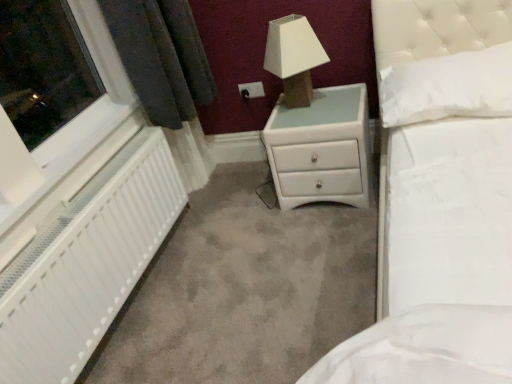
Question: Does white glossy chest of drawers at center have a greater width compared to white textured radiator at left?

Choices:
 (A) yes
 (B) no

Answer: (A)

Question: Is white glossy chest of drawers at center to the right of white textured radiator at left from the viewer's perspective?

Choices:
 (A) yes
 (B) no

Answer: (A)

Question: Would you say white glossy chest of drawers at center is a long distance from white textured radiator at left?

Choices:
 (A) yes
 (B) no

Answer: (B)

Question: Can you confirm if white glossy chest of drawers at center is shorter than white textured radiator at left?

Choices:
 (A) yes
 (B) no

Answer: (A)

Question: From a real-world perspective, is white glossy chest of drawers at center on top of white textured radiator at left?

Choices:
 (A) yes
 (B) no

Answer: (B)

Question: Is white glossy chest of drawers at center positioned in front of white textured radiator at left?

Choices:
 (A) no
 (B) yes

Answer: (A)

Question: Is white plastic window at left taller than white fabric lampshade at upper center?

Choices:
 (A) no
 (B) yes

Answer: (A)

Question: Is the position of white plastic window at left more distant than that of white fabric lampshade at upper center?

Choices:
 (A) yes
 (B) no

Answer: (B)

Question: Is white plastic window at left at the left side of white fabric lampshade at upper center?

Choices:
 (A) no
 (B) yes

Answer: (B)

Question: Are white plastic window at left and white fabric lampshade at upper center far apart?

Choices:
 (A) yes
 (B) no

Answer: (B)

Question: From a real-world perspective, is white plastic window at left over white fabric lampshade at upper center?

Choices:
 (A) no
 (B) yes

Answer: (A)

Question: Does white plastic window at left have a lesser width compared to white fabric lampshade at upper center?

Choices:
 (A) yes
 (B) no

Answer: (A)

Question: Does white plastic electric outlet at upper center turn towards white textured radiator at left?

Choices:
 (A) yes
 (B) no

Answer: (A)